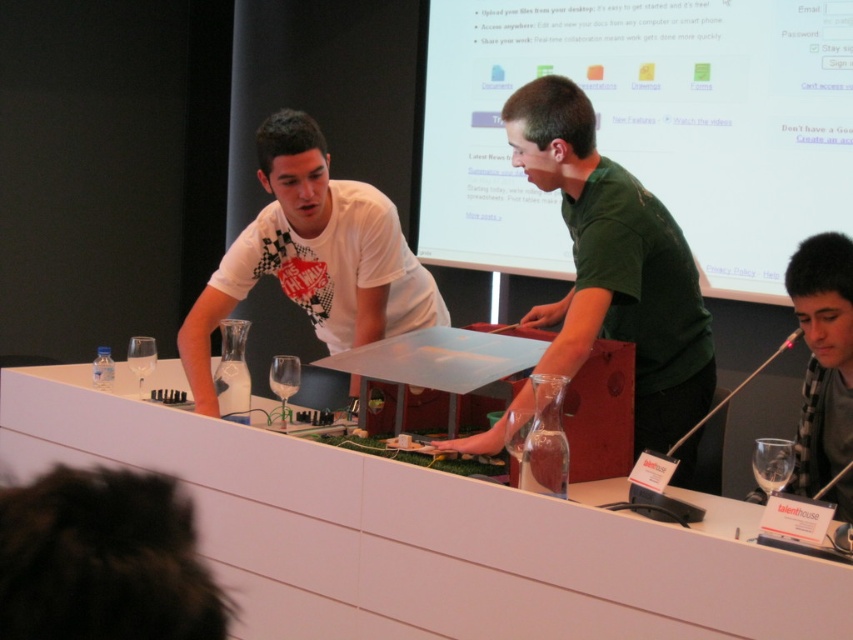
You are at a conference table and need to place a document on the table. There is a transparent glass at lower right and a clear glass wine glass at left. Which glass should you avoid placing the document near to prevent it from sliding off?

You should avoid placing the document near the transparent glass at lower right because it is located below the clear glass wine glass at left, meaning it might be positioned lower and closer to the edge of the table where the document could slide off more easily.

You are standing in the conference room and need to place a small object on the transparent glass at lower right. According to the coordinates provided, where should you aim to place it?

The transparent glass at lower right is located at coordinates point (770,467), so you should aim for that exact point to place the small object there.